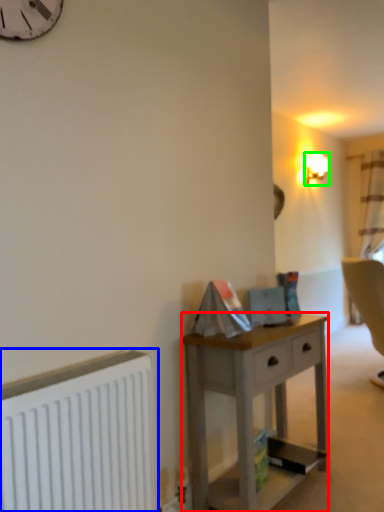
Question: Based on their relative distances, which object is nearer to desk (highlighted by a red box)? Choose from radiator (highlighted by a blue box) and lamp (highlighted by a green box).

Choices:
 (A) radiator
 (B) lamp

Answer: (A)